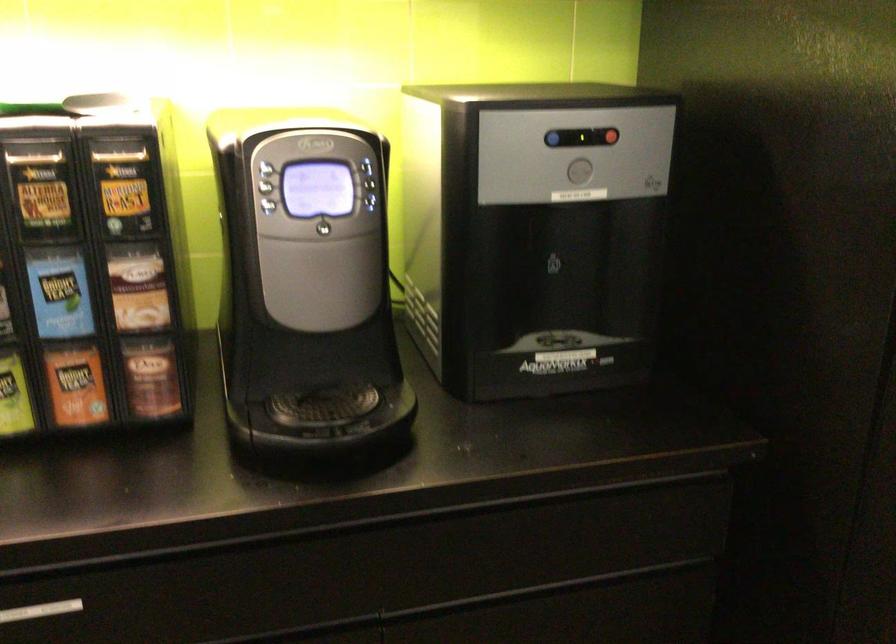
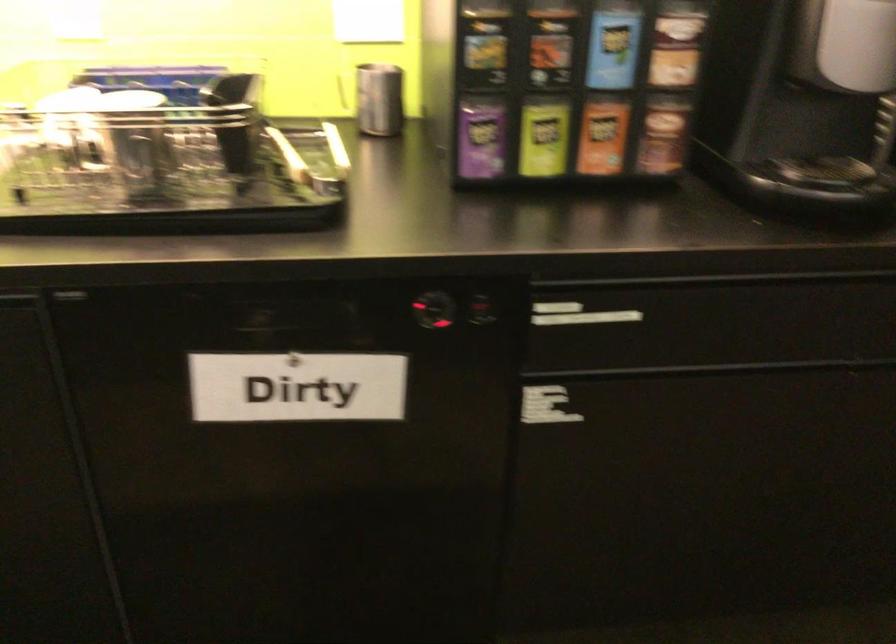
Question: The images are taken continuously from a first-person perspective. In which direction is your viewpoint rotating?

Choices:
 (A) Left
 (B) Right
 (C) Up
 (D) Down

Answer: (D)